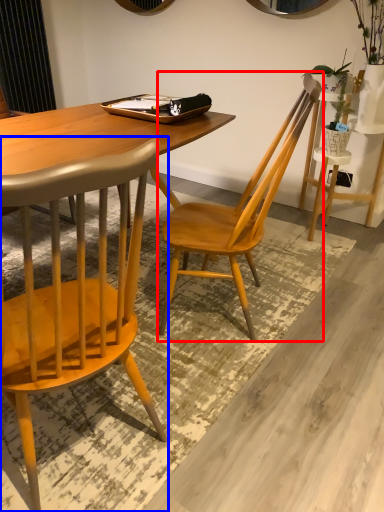
Question: Which object appears farthest to the camera in this image, chair (highlighted by a red box) or chair (highlighted by a blue box)?

Choices:
 (A) chair
 (B) chair

Answer: (A)